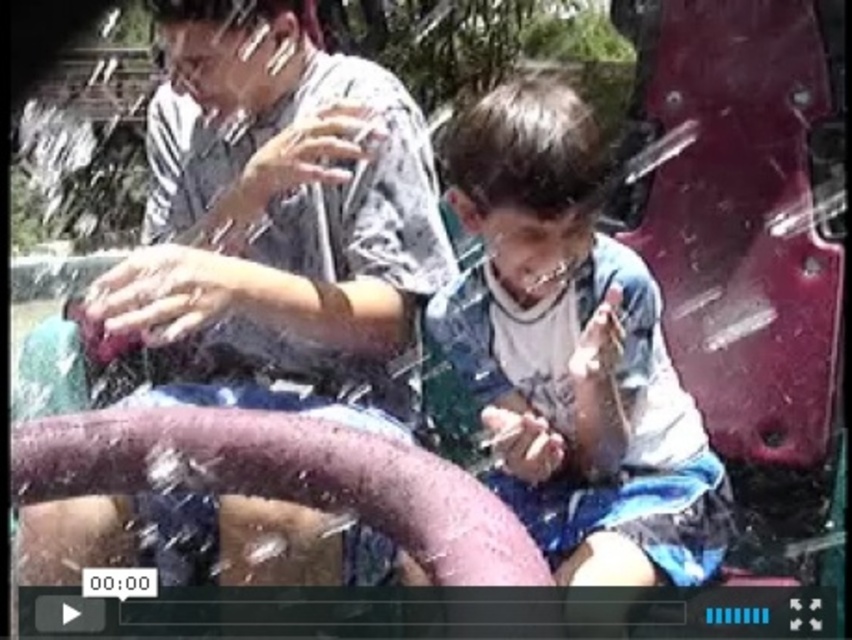
Question: Which point is farther to the camera?

Choices:
 (A) blue denim shorts at center
 (B) matte gray shirt at center

Answer: (B)

Question: Does matte gray shirt at center have a smaller size compared to blue denim shorts at center?

Choices:
 (A) yes
 (B) no

Answer: (B)

Question: Which point is closer to the camera taking this photo?

Choices:
 (A) (584, 509)
 (B) (338, 572)

Answer: (B)

Question: Does matte gray shirt at center appear over blue denim shorts at center?

Choices:
 (A) no
 (B) yes

Answer: (B)

Question: In this image, where is matte gray shirt at center located relative to blue denim shorts at center?

Choices:
 (A) right
 (B) left

Answer: (B)